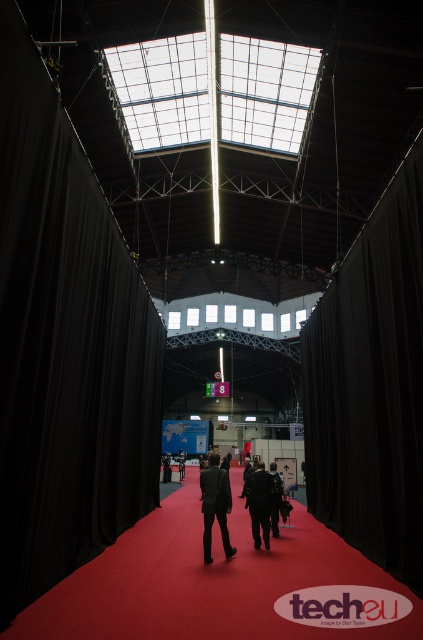
Looking at this image, you are an event planner setting up for a formal event. You need to ensure that the black fabric curtain at left and the black fabric curtain at right are of equal height for symmetry. Which curtain should you adjust and how?

The black fabric curtain at left is shorter than the black fabric curtain at right, so you should lengthen the black fabric curtain at left to match the height of the black fabric curtain at right.

You are an event planner setting up for a formal event. You need to ensure that the black fabric curtain at left and the black fabric curtain at right are arranged so that neither blocks the view of the stage. Given their positions, which curtain might be obscuring the other?

The black fabric curtain at left is positioned under the black fabric curtain at right, so the curtain at right is higher and might be obscuring the view of the curtain at left. However, since both are curtains, their placement under each other might not block the stage view but rather frame the pathway.

You are standing at the entrance of the exhibition hall and see a red carpeted walkway flanked by black curtains on both sides. There is a point marked at coordinates (370, 385) in the image. What object is located at this point?

The point at coordinates (370, 385) indicates the location of the black fabric curtain at right.